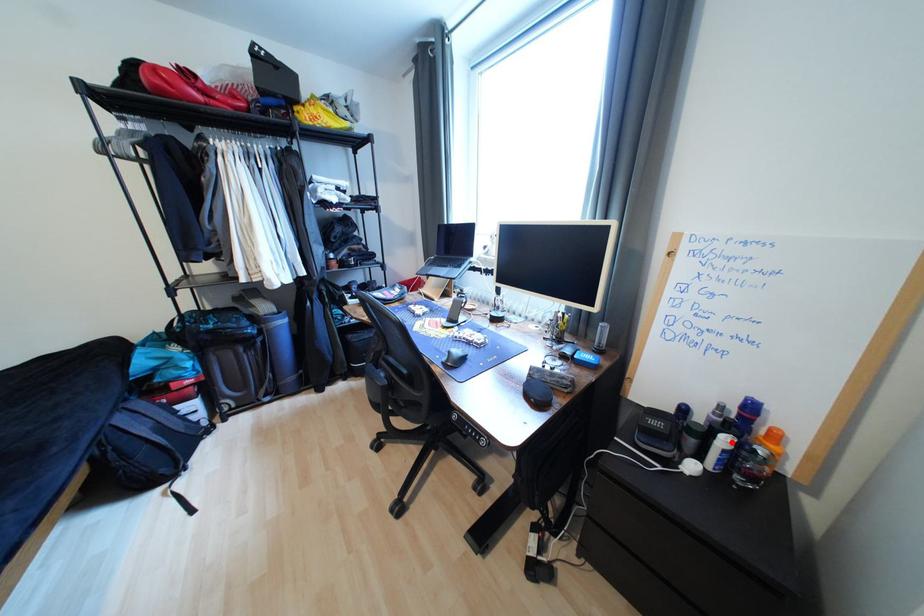
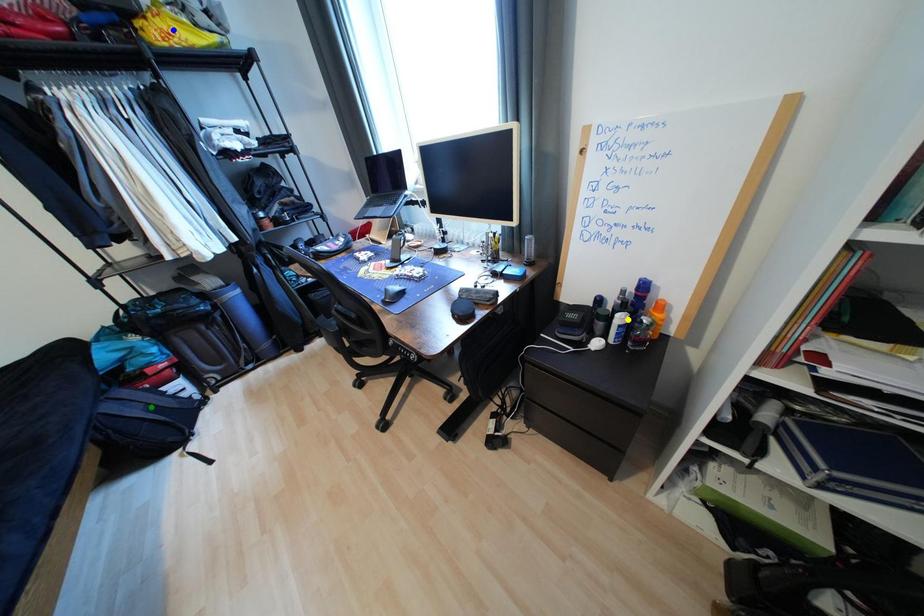
Question: I am providing you with two images of the same scene from different viewpoints. A red point is marked on the first image. You are given multiple points on the second image. Which spot in image 2 lines up with the point in image 1?

Choices:
 (A) blue point
 (B) yellow point
 (C) green point

Answer: (B)